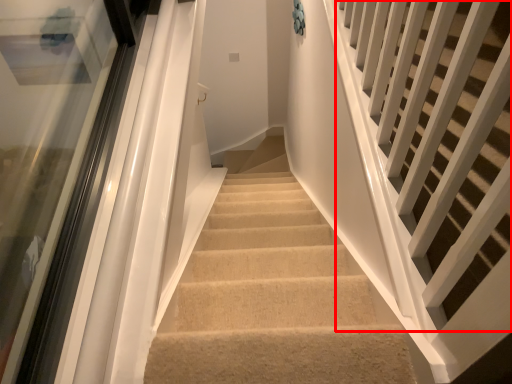
Question: Where is stairs (annotated by the red box) located in relation to glass door in the image?

Choices:
 (A) left
 (B) right

Answer: (B)